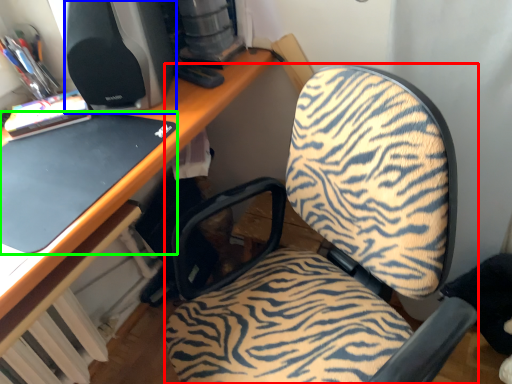
Question: Which is nearer to the furniture (highlighted by a red box)? desktop computer (highlighted by a blue box) or laptop (highlighted by a green box).

Choices:
 (A) desktop computer
 (B) laptop

Answer: (B)